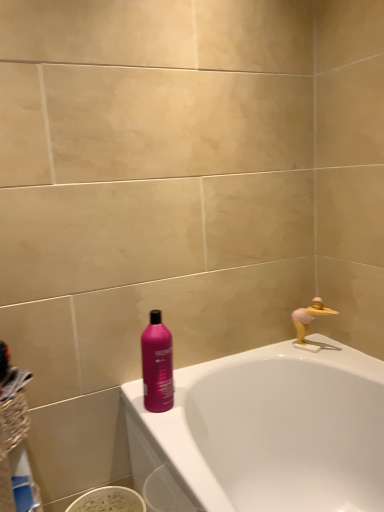
Locate an element on the screen. The height and width of the screenshot is (512, 384). free space in front of matte pink bottle at center is located at coordinates (173, 431).